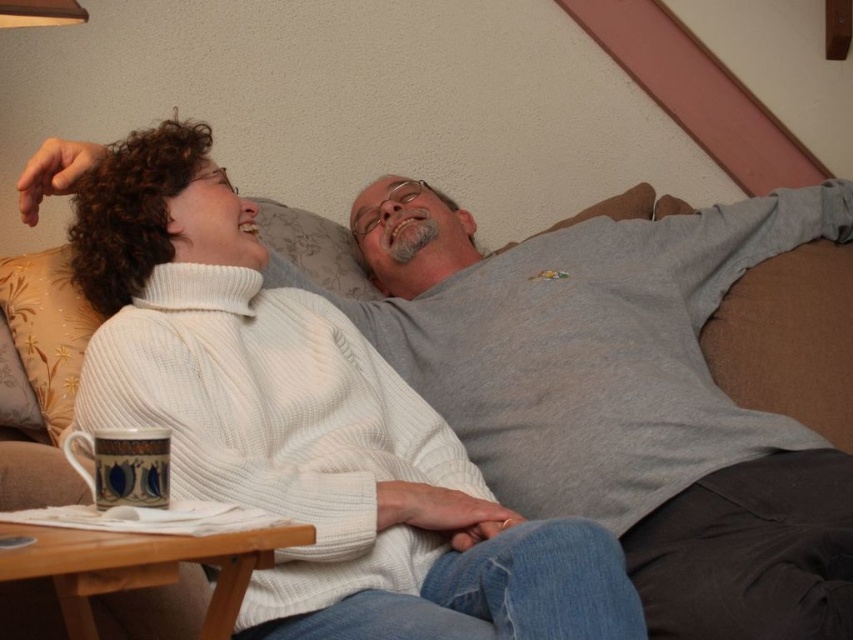
Question: Which object appears closest to the camera in this image?

Choices:
 (A) blue and white ceramic mug at lower left
 (B) dark gray fabric at lower right

Answer: (A)

Question: Is dark gray fabric at lower right bigger than blue and white ceramic mug at lower left?

Choices:
 (A) no
 (B) yes

Answer: (B)

Question: Is dark gray fabric at lower right to the right of blue and white ceramic mug at lower left from the viewer's perspective?

Choices:
 (A) no
 (B) yes

Answer: (B)

Question: Which object appears closest to the camera in this image?

Choices:
 (A) blue and white ceramic mug at lower left
 (B) dark gray fabric at lower right

Answer: (A)

Question: Does dark gray fabric at lower right have a smaller size compared to blue and white ceramic mug at lower left?

Choices:
 (A) no
 (B) yes

Answer: (A)